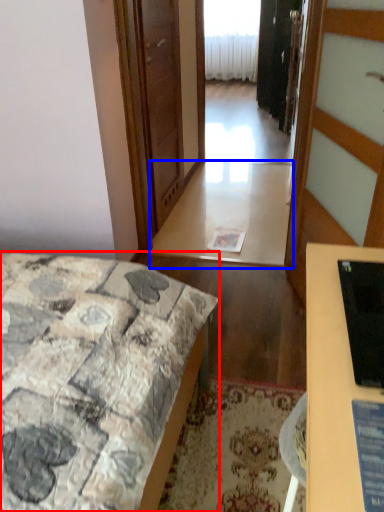
Question: Among these objects, which one is farthest to the camera, bed (highlighted by a red box) or table (highlighted by a blue box)?

Choices:
 (A) bed
 (B) table

Answer: (B)